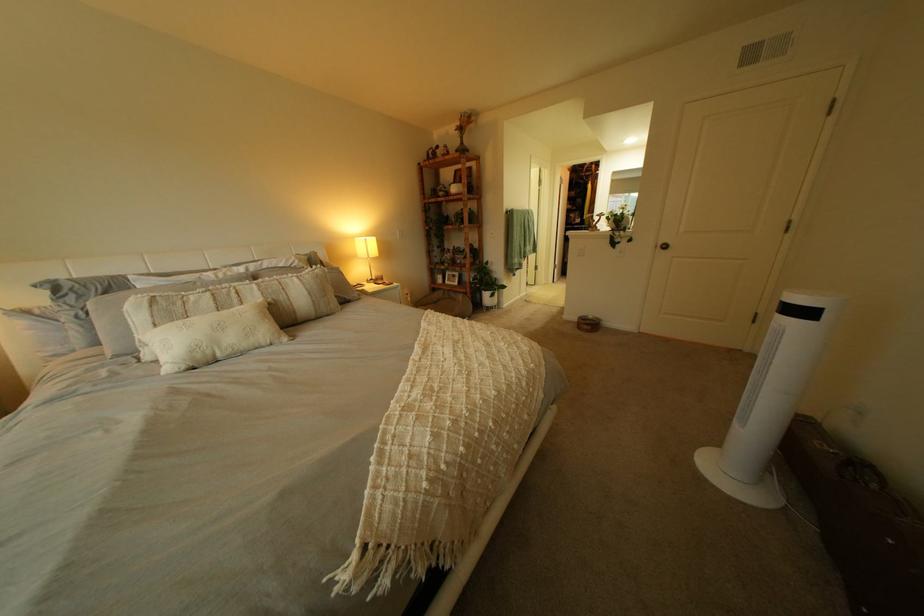
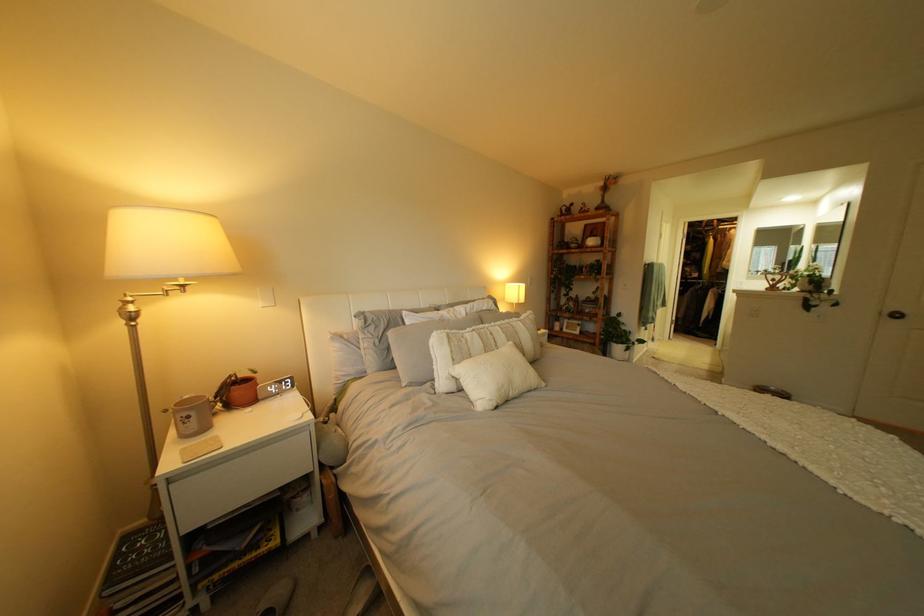
Where in the second image is the point corresponding to [274,294] from the first image?

(518, 337)